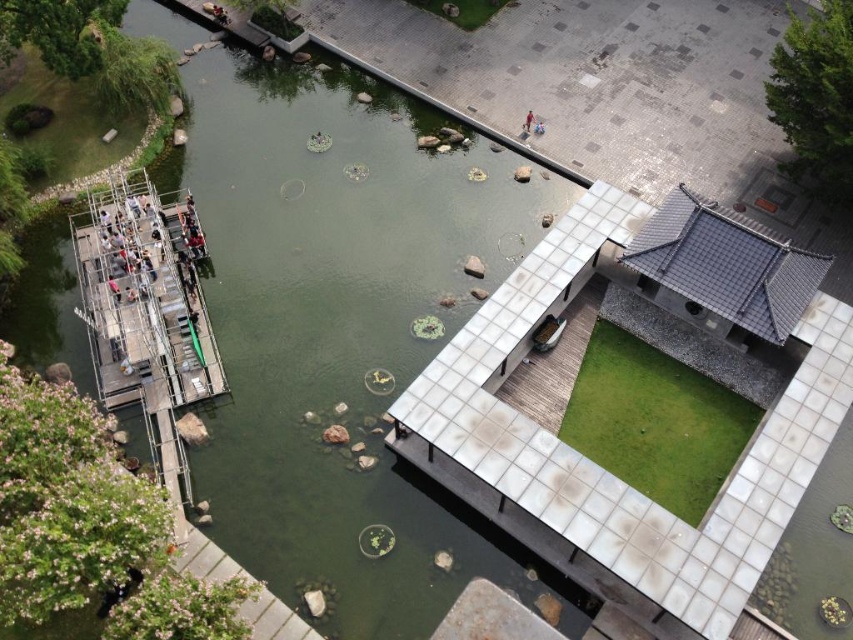
Does metallic dock at left lie in front of red fabric person at center?

Yes, it is in front of red fabric person at center.

Between point (170, 356) and point (527, 129), which one is positioned in front?

Point (170, 356) is in front.

What are the coordinates of `metallic dock at left` in the screenshot? It's located at [144, 298].

Between point (554, 339) and point (527, 131), which one is positioned behind?

Positioned behind is point (527, 131).

Consider the image. Who is more forward, (x=543, y=348) or (x=526, y=122)?

Positioned in front is point (x=543, y=348).

Which is in front, point (556, 326) or point (532, 120)?

Point (556, 326) is more forward.

This screenshot has width=853, height=640. In order to click on metallic silver boat at center in this screenshot , I will do `click(548, 333)`.

Which is in front, point (160, 344) or point (538, 332)?

Point (160, 344) is in front.

Between metallic dock at left and metallic silver boat at center, which one has more height?

metallic dock at left is taller.

The width and height of the screenshot is (853, 640). What do you see at coordinates (144, 298) in the screenshot?
I see `metallic dock at left` at bounding box center [144, 298].

This screenshot has width=853, height=640. Identify the location of metallic dock at left. (144, 298).